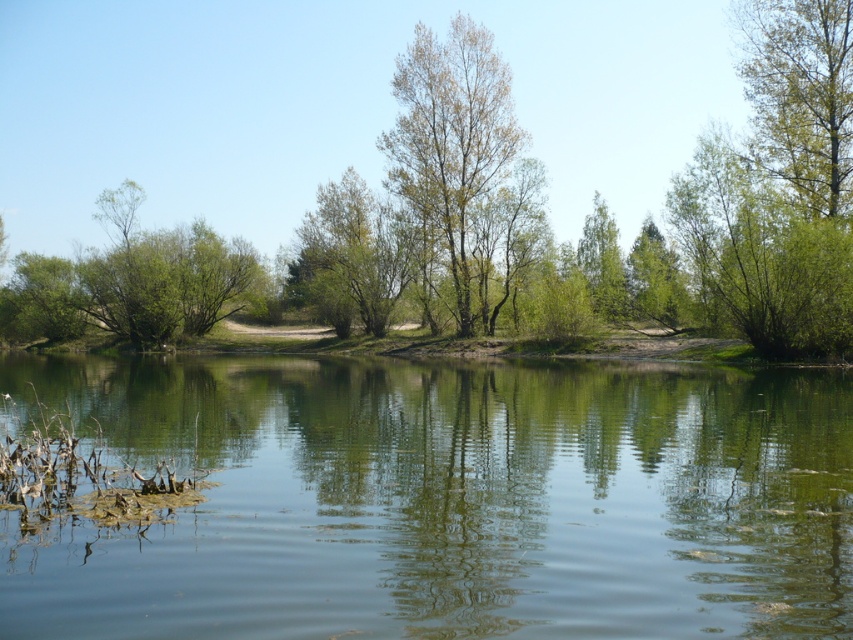
Between green leafy tree at center and green leafy tree at upper right, which one has more height?

green leafy tree at center

Does green leafy tree at center have a smaller size compared to green leafy tree at upper right?

Yes.

Is point (466, 282) closer to viewer compared to point (845, 131)?

That is False.

I want to click on green leafy tree at center, so click(x=463, y=163).

Is green leafy bush at left smaller than green leafy tree at upper right?

Yes.

Between green leafy bush at left and green leafy tree at upper right, which one appears on the left side from the viewer's perspective?

Positioned to the left is green leafy bush at left.

What do you see at coordinates (131, 282) in the screenshot? This screenshot has height=640, width=853. I see `green leafy bush at left` at bounding box center [131, 282].

Where is `green leafy bush at left`? This screenshot has width=853, height=640. green leafy bush at left is located at coordinates (131, 282).

Between point (120, 372) and point (764, 58), which one is positioned in front?

Point (120, 372) is in front.

Does green reflective water at center have a lesser width compared to green leafy tree at upper right?

In fact, green reflective water at center might be wider than green leafy tree at upper right.

Which is in front, point (503, 632) or point (814, 122)?

Positioned in front is point (503, 632).

Where is `green reflective water at center`? Image resolution: width=853 pixels, height=640 pixels. green reflective water at center is located at coordinates (448, 500).